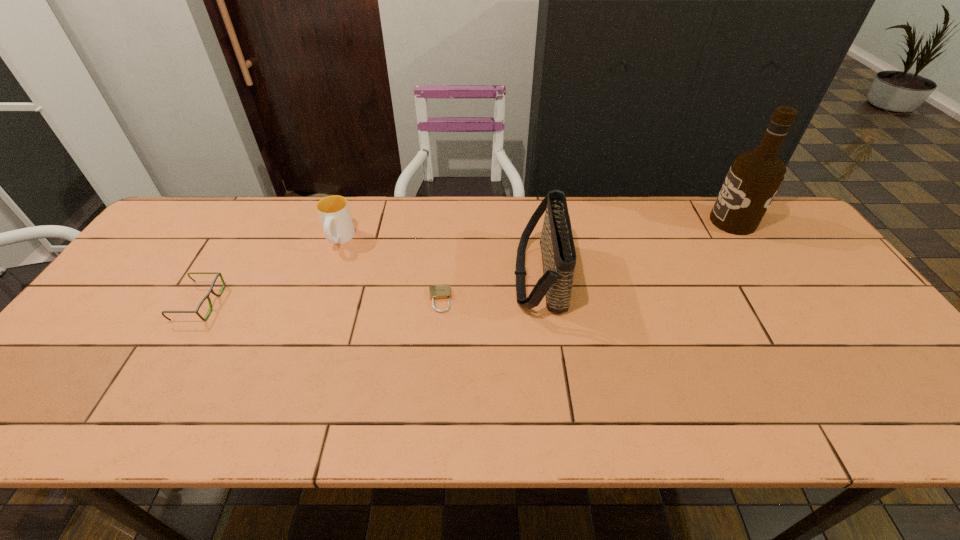
At what (x,y) coordinates should I click in order to perform the action: click on vacant point located between the handbag and the leftmost object. Please return your answer as a coordinate pair (x, y). This screenshot has width=960, height=540. Looking at the image, I should click on (370, 290).

Where is `vacant area that lies between the second tallest object and the tallest object`? The image size is (960, 540). vacant area that lies between the second tallest object and the tallest object is located at coordinates 636,249.

The width and height of the screenshot is (960, 540). In order to click on unoccupied position between the shortest object and the rightmost object in this screenshot , I will do `click(587, 261)`.

Identify the location of blank region between the fourth tallest object and the padlock. (320, 302).

Identify the location of empty location between the second shortest object and the third object from right to left. (320, 302).

This screenshot has width=960, height=540. I want to click on unoccupied area between the second object from right to left and the cup, so (x=440, y=258).

Where is `free point between the padlock and the leftmost object`? free point between the padlock and the leftmost object is located at coordinates (320, 302).

Identify the location of vacant region between the fourth object from right to left and the padlock. (389, 269).

This screenshot has height=540, width=960. Find the location of `object that is the second closest to the leftmost object`. object that is the second closest to the leftmost object is located at coordinates (437, 292).

In order to click on object that is the second nearest to the second object from left to right in this screenshot , I will do `click(437, 292)`.